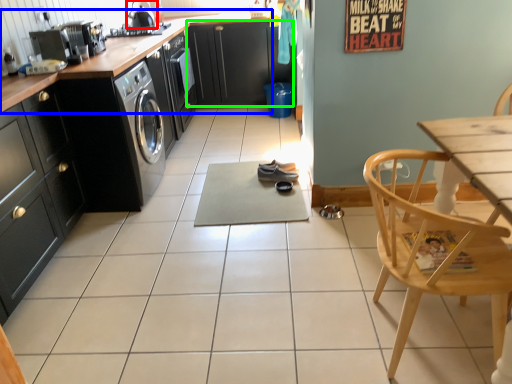
Question: Which object is the farthest from appliance (highlighted by a red box)? Choose among these: countertop (highlighted by a blue box) or cabinetry (highlighted by a green box).

Choices:
 (A) countertop
 (B) cabinetry

Answer: (B)